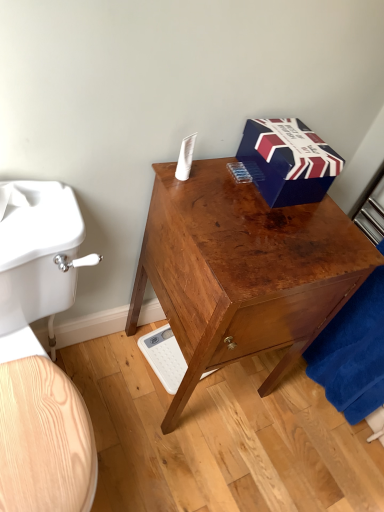
Question: From the image's perspective, would you say blue cardboard box at upper right is shown under shiny brown wooden desk at center?

Choices:
 (A) no
 (B) yes

Answer: (A)

Question: Is blue cardboard box at upper right looking in the opposite direction of shiny brown wooden desk at center?

Choices:
 (A) no
 (B) yes

Answer: (A)

Question: Does blue cardboard box at upper right have a smaller size compared to shiny brown wooden desk at center?

Choices:
 (A) yes
 (B) no

Answer: (A)

Question: From a real-world perspective, is blue cardboard box at upper right located beneath shiny brown wooden desk at center?

Choices:
 (A) yes
 (B) no

Answer: (B)

Question: Is blue cardboard box at upper right to the right of shiny brown wooden desk at center from the viewer's perspective?

Choices:
 (A) no
 (B) yes

Answer: (B)

Question: In the image, is shiny brown wooden desk at center positioned in front of or behind white matte toilet paper at upper center?

Choices:
 (A) behind
 (B) front

Answer: (B)

Question: From the image's perspective, is shiny brown wooden desk at center located above or below white matte toilet paper at upper center?

Choices:
 (A) above
 (B) below

Answer: (B)

Question: Considering the relative positions of shiny brown wooden desk at center and white matte toilet paper at upper center in the image provided, is shiny brown wooden desk at center to the left or to the right of white matte toilet paper at upper center?

Choices:
 (A) right
 (B) left

Answer: (A)

Question: Do you think shiny brown wooden desk at center is within white matte toilet paper at upper center, or outside of it?

Choices:
 (A) inside
 (B) outside

Answer: (B)

Question: Is shiny brown wooden desk at center inside the boundaries of blue cardboard box at upper right, or outside?

Choices:
 (A) outside
 (B) inside

Answer: (A)

Question: From the image's perspective, is shiny brown wooden desk at center positioned above or below blue cardboard box at upper right?

Choices:
 (A) above
 (B) below

Answer: (B)

Question: Based on their sizes in the image, would you say shiny brown wooden desk at center is bigger or smaller than blue cardboard box at upper right?

Choices:
 (A) big
 (B) small

Answer: (A)

Question: Is shiny brown wooden desk at center wider or thinner than blue cardboard box at upper right?

Choices:
 (A) thin
 (B) wide

Answer: (B)

Question: Is point (157, 373) closer or farther from the camera than point (185, 170)?

Choices:
 (A) farther
 (B) closer

Answer: (A)

Question: In the image, is white plastic scale at lower center positioned in front of or behind white matte toilet paper at upper center?

Choices:
 (A) behind
 (B) front

Answer: (A)